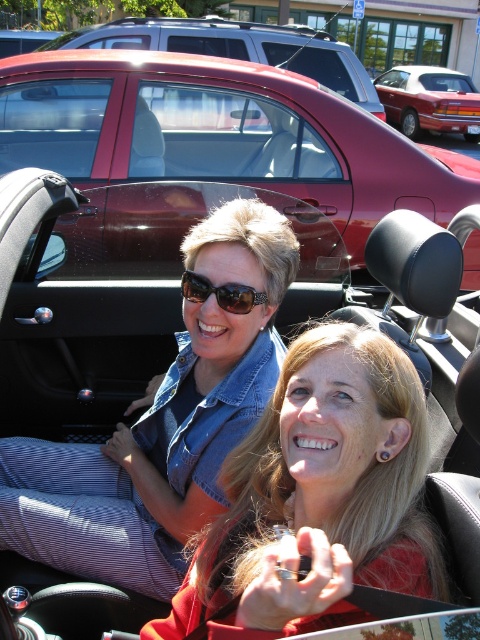
You are a photographer wanting to capture the matte black car at center and the brown textured sunglasses at center in a single shot. Since the car is closer to you, will the sunglasses appear smaller in the photo compared to the car?

Yes, the brown textured sunglasses at center will appear smaller in the photo because the matte black car at center is closer to the viewer, making the sunglasses farther away and thus smaller in the frame.

You are a photographer planning to take a photo of the shiny maroon convertible at center and the brown textured sunglasses at center. Which object should you focus on first if you want to capture both in the frame without moving the camera?

The shiny maroon convertible at center should be focused on first because it is larger in size compared to the brown textured sunglasses at center, ensuring it fits well within the frame.

Looking at this image, you are standing in front of the car and want to place a sticker exactly at the coordinates point (317,497). Based on the scene description, where will the sticker be placed?

The sticker will be placed on the matte black car at center, as point (317,497) is on matte black car at center.